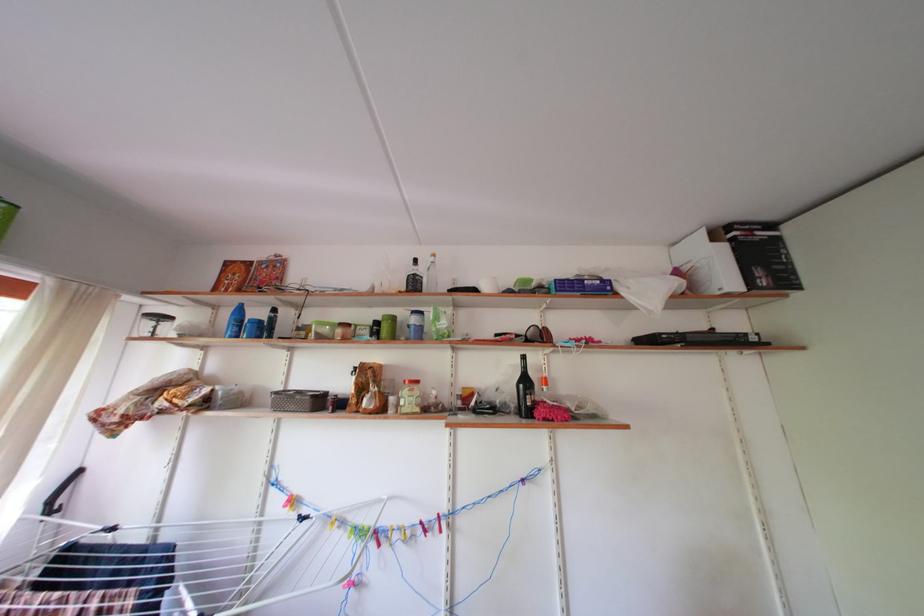
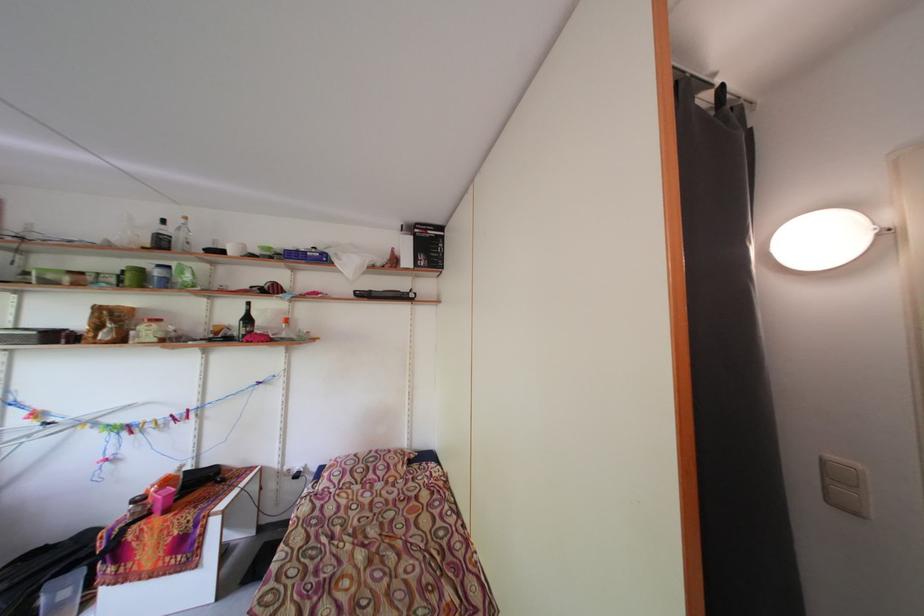
In the second image, find the point that corresponds to (377,315) in the first image.

(127, 265)